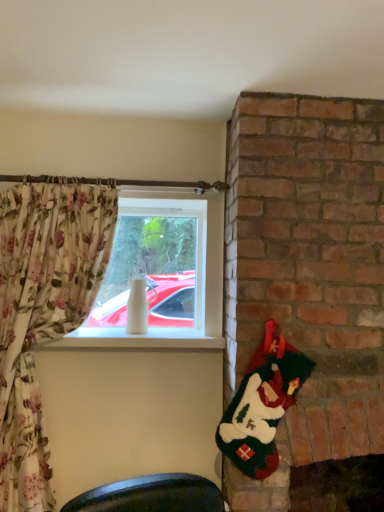
What is the approximate width of white glossy vase at center?

The width of white glossy vase at center is 6.32 centimeters.

Where is `white glossy vase at center`? white glossy vase at center is located at coordinates (195, 276).

This screenshot has width=384, height=512. What do you see at coordinates (195, 276) in the screenshot? I see `white glossy vase at center` at bounding box center [195, 276].

Where is `fuzzy green santa at right`? The width and height of the screenshot is (384, 512). fuzzy green santa at right is located at coordinates (262, 404).

The height and width of the screenshot is (512, 384). Describe the element at coordinates (262, 404) in the screenshot. I see `fuzzy green santa at right` at that location.

What is the approximate height of fuzzy green santa at right?

It is 62.16 centimeters.

You are a GUI agent. You are given a task and a screenshot of the screen. Output one action in this format:
    pyautogui.click(x=<x>, y=<y>)
    Task: Click on the white glossy vase at center
    
    Given the screenshot: What is the action you would take?
    pyautogui.click(x=195, y=276)

Considering the positions of objects white glossy vase at center and fuzzy green santa at right in the image provided, who is more to the right, white glossy vase at center or fuzzy green santa at right?

fuzzy green santa at right.

Which object is closer to the camera, white glossy vase at center or fuzzy green santa at right?

fuzzy green santa at right.

Considering the positions of points (175, 329) and (253, 359), is point (175, 329) farther from camera compared to point (253, 359)?

Yes, point (175, 329) is behind point (253, 359).

From the image's perspective, is white glossy vase at center below fuzzy green santa at right?

Incorrect, from the image's perspective, white glossy vase at center is higher than fuzzy green santa at right.

From a real-world perspective, relative to fuzzy green santa at right, is white glossy vase at center vertically above or below?

Clearly, from a real-world perspective, white glossy vase at center is above fuzzy green santa at right.

Considering the sizes of white glossy vase at center and fuzzy green santa at right in the image, is white glossy vase at center wider or thinner than fuzzy green santa at right?

Considering their sizes, white glossy vase at center looks broader than fuzzy green santa at right.

Is white glossy vase at center taller or shorter than fuzzy green santa at right?

white glossy vase at center is taller than fuzzy green santa at right.

Is white glossy vase at center smaller than fuzzy green santa at right?

No.

Is white glossy vase at center not inside fuzzy green santa at right?

Yes, white glossy vase at center is outside of fuzzy green santa at right.

Does white glossy vase at center touch fuzzy green santa at right?

There is a gap between white glossy vase at center and fuzzy green santa at right.

Is white glossy vase at center positioned with its back to fuzzy green santa at right?

No, white glossy vase at center is not facing away from fuzzy green santa at right.

Can you tell me how much white glossy vase at center and fuzzy green santa at right differ in facing direction?

2.1 degrees.

The height and width of the screenshot is (512, 384). What are the coordinates of `santa claus on the right of white glossy vase at center` in the screenshot? It's located at (262, 404).

Is fuzzy green santa at right at the right side of white glossy vase at center?

Indeed, fuzzy green santa at right is positioned on the right side of white glossy vase at center.

Who is more distant, fuzzy green santa at right or white glossy vase at center?

white glossy vase at center is behind.

Is point (297, 360) positioned after point (170, 202)?

No, it is not.

From the image's perspective, is fuzzy green santa at right located above or below white glossy vase at center?

fuzzy green santa at right is situated lower than white glossy vase at center in the image.

From a real-world perspective, who is located lower, fuzzy green santa at right or white glossy vase at center?

fuzzy green santa at right is physically lower.

Is fuzzy green santa at right wider or thinner than white glossy vase at center?

Clearly, fuzzy green santa at right has less width compared to white glossy vase at center.

Who is shorter, fuzzy green santa at right or white glossy vase at center?

Standing shorter between the two is fuzzy green santa at right.

In terms of size, does fuzzy green santa at right appear bigger or smaller than white glossy vase at center?

In the image, fuzzy green santa at right appears to be smaller than white glossy vase at center.

Is white glossy vase at center a part of fuzzy green santa at right?

No, white glossy vase at center is not inside fuzzy green santa at right.

Are fuzzy green santa at right and white glossy vase at center far apart?

They are positioned close to each other.

Is fuzzy green santa at right turned away from white glossy vase at center?

No, fuzzy green santa at right is not facing the opposite direction of white glossy vase at center.

What's the angular difference between fuzzy green santa at right and white glossy vase at center's facing directions?

The angle between the facing direction of fuzzy green santa at right and the facing direction of white glossy vase at center is 2.1 degrees.

Where is `window behind the fuzzy green santa at right`? The image size is (384, 512). window behind the fuzzy green santa at right is located at coordinates (195, 276).

Where is `santa claus that is in front of the white glossy vase at center`? This screenshot has width=384, height=512. santa claus that is in front of the white glossy vase at center is located at coordinates (262, 404).

You are a GUI agent. You are given a task and a screenshot of the screen. Output one action in this format:
    pyautogui.click(x=<x>, y=<y>)
    Task: Click on the window that appears above the fuzzy green santa at right (from the image's perspective)
    
    Given the screenshot: What is the action you would take?
    pyautogui.click(x=195, y=276)